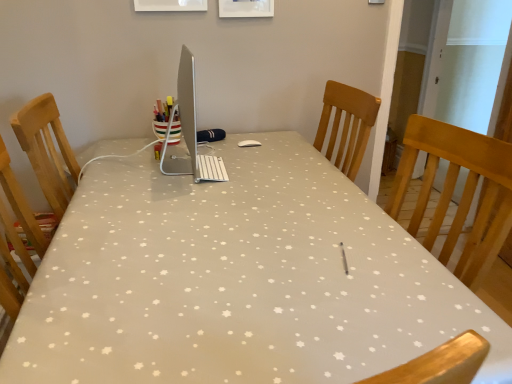
Identify the location of free space in front of sleek silver desktop at center. (165, 206).